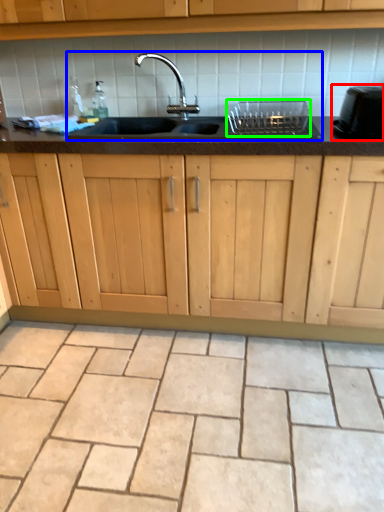
Question: Based on their relative distances, which object is nearer to appliance (highlighted by a red box)? Choose from sink (highlighted by a blue box) and appliance (highlighted by a green box).

Choices:
 (A) sink
 (B) appliance

Answer: (B)